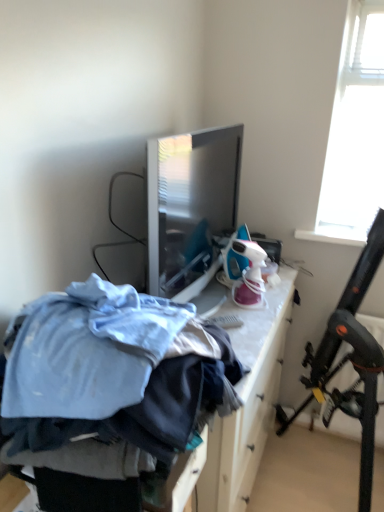
This screenshot has width=384, height=512. What do you see at coordinates (350, 361) in the screenshot? I see `black plastic folding chair at upper right` at bounding box center [350, 361].

Locate an element on the screen. The height and width of the screenshot is (512, 384). black plastic folding chair at upper right is located at coordinates (350, 361).

Locate an element on the screen. The width and height of the screenshot is (384, 512). blue fabric pile at center is located at coordinates (241, 409).

The height and width of the screenshot is (512, 384). Describe the element at coordinates (241, 409) in the screenshot. I see `blue fabric pile at center` at that location.

Where is `black plastic folding chair at upper right`? The height and width of the screenshot is (512, 384). black plastic folding chair at upper right is located at coordinates (350, 361).

In the image, is blue fabric pile at center on the left side or the right side of black plastic folding chair at upper right?

blue fabric pile at center is positioned on black plastic folding chair at upper right's left side.

Between blue fabric pile at center and black plastic folding chair at upper right, which one is positioned behind?

black plastic folding chair at upper right is further from the camera.

Does point (219, 447) appear closer or farther from the camera than point (312, 357)?

Point (219, 447) is closer to the camera than point (312, 357).

From the image's perspective, is blue fabric pile at center located above or below black plastic folding chair at upper right?

Clearly, from the image's perspective, blue fabric pile at center is above black plastic folding chair at upper right.

From a real-world perspective, is blue fabric pile at center positioned above or below black plastic folding chair at upper right?

In terms of real-world spatial position, blue fabric pile at center is above black plastic folding chair at upper right.

Is blue fabric pile at center wider or thinner than black plastic folding chair at upper right?

In the image, blue fabric pile at center appears to be more narrow than black plastic folding chair at upper right.

Considering the relative sizes of blue fabric pile at center and black plastic folding chair at upper right in the image provided, is blue fabric pile at center shorter than black plastic folding chair at upper right?

Yes.

Is blue fabric pile at center smaller than black plastic folding chair at upper right?

Yes.

Is blue fabric pile at center inside or outside of black plastic folding chair at upper right?

blue fabric pile at center is outside black plastic folding chair at upper right.

Is the surface of blue fabric pile at center in direct contact with black plastic folding chair at upper right?

blue fabric pile at center and black plastic folding chair at upper right are not in contact.

From the picture: Is blue fabric pile at center turned away from black plastic folding chair at upper right?

No, blue fabric pile at center is not facing the opposite direction of black plastic folding chair at upper right.

How distant is blue fabric pile at center from black plastic folding chair at upper right?

blue fabric pile at center is 16.27 inches away from black plastic folding chair at upper right.

This screenshot has height=512, width=384. In order to click on folding chair below the blue fabric pile at center (from a real-world perspective) in this screenshot , I will do `click(350, 361)`.

Considering the positions of objects black plastic folding chair at upper right and blue fabric pile at center in the image provided, who is more to the left, black plastic folding chair at upper right or blue fabric pile at center?

blue fabric pile at center.

Considering the positions of objects black plastic folding chair at upper right and blue fabric pile at center in the image provided, who is in front, black plastic folding chair at upper right or blue fabric pile at center?

blue fabric pile at center is more forward.

Between point (348, 338) and point (275, 392), which one is positioned in front?

The point (348, 338) is in front.

From the image's perspective, is black plastic folding chair at upper right below blue fabric pile at center?

Indeed, from the image's perspective, black plastic folding chair at upper right is shown beneath blue fabric pile at center.

From a real-world perspective, relative to blue fabric pile at center, is black plastic folding chair at upper right vertically above or below?

In terms of real-world spatial position, black plastic folding chair at upper right is below blue fabric pile at center.

Considering the relative sizes of black plastic folding chair at upper right and blue fabric pile at center in the image provided, is black plastic folding chair at upper right wider than blue fabric pile at center?

Indeed, black plastic folding chair at upper right has a greater width compared to blue fabric pile at center.

In terms of height, does black plastic folding chair at upper right look taller or shorter compared to blue fabric pile at center?

In the image, black plastic folding chair at upper right appears to be taller than blue fabric pile at center.

Based on the photo, considering the relative sizes of black plastic folding chair at upper right and blue fabric pile at center in the image provided, is black plastic folding chair at upper right smaller than blue fabric pile at center?

→ No.

Is black plastic folding chair at upper right inside the boundaries of blue fabric pile at center, or outside?

black plastic folding chair at upper right is located beyond the bounds of blue fabric pile at center.

Is black plastic folding chair at upper right next to blue fabric pile at center and touching it?

No, black plastic folding chair at upper right is not next to blue fabric pile at center.

Is black plastic folding chair at upper right positioned with its back to blue fabric pile at center?

No, blue fabric pile at center is not at the back of black plastic folding chair at upper right.

How many degrees apart are the facing directions of black plastic folding chair at upper right and blue fabric pile at center?

The angle between the facing direction of black plastic folding chair at upper right and the facing direction of blue fabric pile at center is 89 degrees.

Locate an element on the screen. The width and height of the screenshot is (384, 512). folding chair directly beneath the blue fabric pile at center (from a real-world perspective) is located at coordinates (350, 361).

Image resolution: width=384 pixels, height=512 pixels. Identify the location of furniture lying above the black plastic folding chair at upper right (from the image's perspective). (241, 409).

Locate an element on the screen. This screenshot has width=384, height=512. furniture that is above the black plastic folding chair at upper right (from a real-world perspective) is located at coordinates (241, 409).